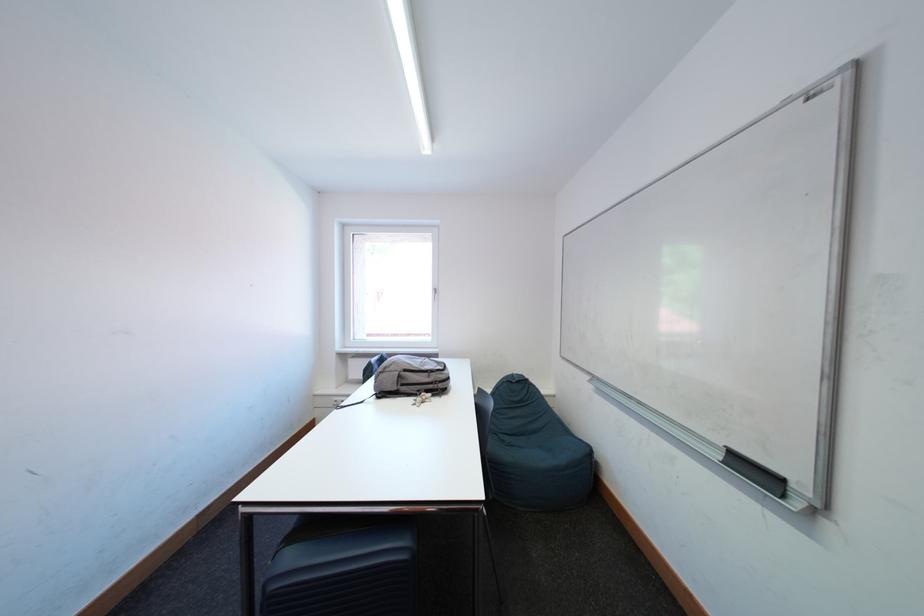
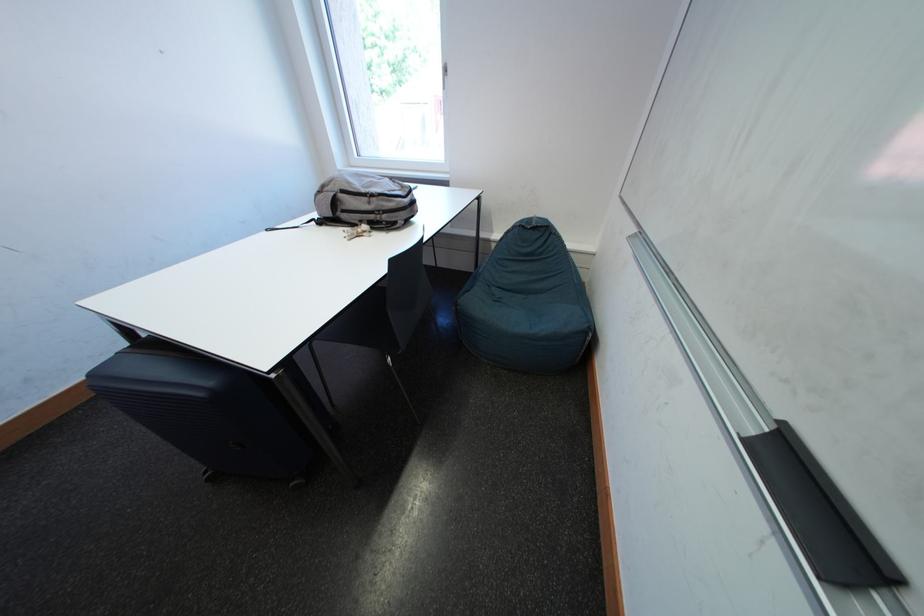
Find the pixel in the second image that matches pixel 732 463 in the first image.

(762, 435)